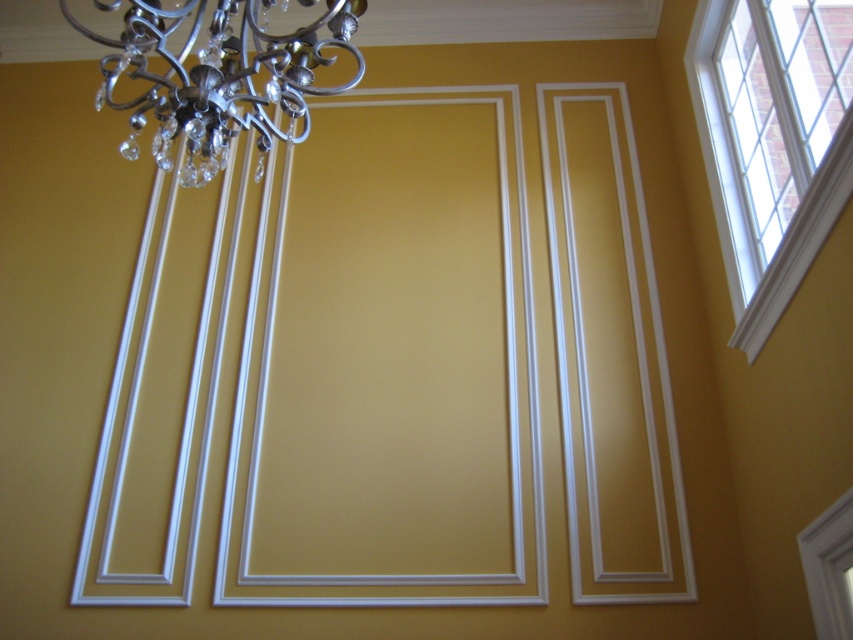
Between point (706, 48) and point (207, 67), which one is positioned in front?

Positioned in front is point (207, 67).

Which of these two, white glass window at upper right or metallic silver chandelier at upper left, stands taller?

Standing taller between the two is white glass window at upper right.

Locate an element on the screen. white glass window at upper right is located at coordinates (761, 168).